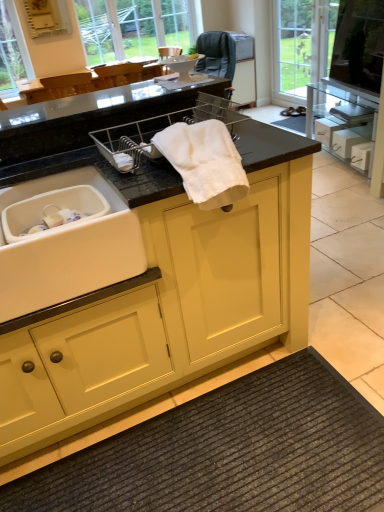
Question: From a real-world perspective, is transparent glass door at upper right under white cotton towel at center?

Choices:
 (A) yes
 (B) no

Answer: (A)

Question: From the image's perspective, would you say transparent glass door at upper right is positioned over white cotton towel at center?

Choices:
 (A) yes
 (B) no

Answer: (A)

Question: Can you confirm if transparent glass door at upper right is wider than white cotton towel at center?

Choices:
 (A) no
 (B) yes

Answer: (A)

Question: Is transparent glass door at upper right bigger than white cotton towel at center?

Choices:
 (A) no
 (B) yes

Answer: (B)

Question: Can you confirm if transparent glass door at upper right is smaller than white cotton towel at center?

Choices:
 (A) yes
 (B) no

Answer: (B)

Question: Does transparent glass door at upper right come behind white cotton towel at center?

Choices:
 (A) yes
 (B) no

Answer: (A)

Question: Is white matte drawer at right with dark gray textured bath mat at lower center?

Choices:
 (A) yes
 (B) no

Answer: (B)

Question: Can you confirm if white matte drawer at right is thinner than dark gray textured bath mat at lower center?

Choices:
 (A) no
 (B) yes

Answer: (B)

Question: Is white matte drawer at right positioned with its back to dark gray textured bath mat at lower center?

Choices:
 (A) no
 (B) yes

Answer: (A)

Question: From a real-world perspective, is white matte drawer at right on dark gray textured bath mat at lower center?

Choices:
 (A) no
 (B) yes

Answer: (B)

Question: Is white matte drawer at right at the left side of dark gray textured bath mat at lower center?

Choices:
 (A) no
 (B) yes

Answer: (A)

Question: Is there a large distance between white matte drawer at right and dark gray textured bath mat at lower center?

Choices:
 (A) yes
 (B) no

Answer: (A)

Question: Can you confirm if matte yellow cabinet at center is wider than clear glass window at upper center?

Choices:
 (A) no
 (B) yes

Answer: (B)